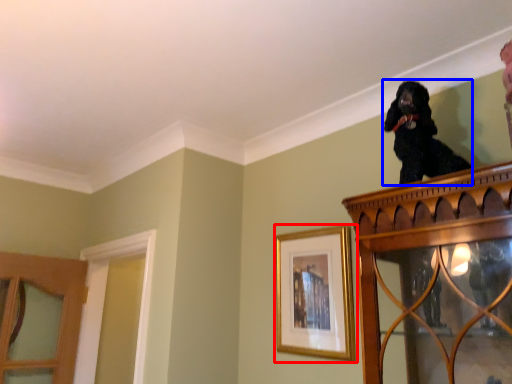
Question: Which object appears closest to the camera in this image, picture frame (highlighted by a red box) or dog (highlighted by a blue box)?

Choices:
 (A) picture frame
 (B) dog

Answer: (B)